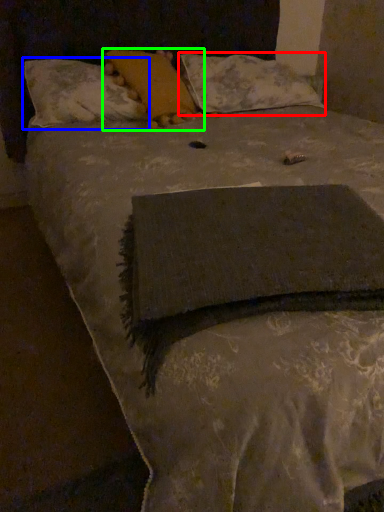
Question: Based on their relative distances, which object is nearer to pillow (highlighted by a red box)? Choose from pillow (highlighted by a blue box) and pillow (highlighted by a green box).

Choices:
 (A) pillow
 (B) pillow

Answer: (B)